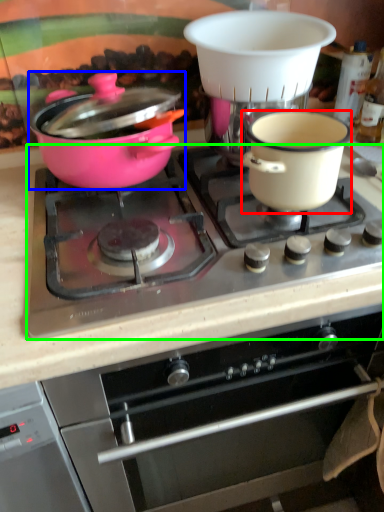
Question: Estimate the real-world distances between objects in this image. Which object is farther from bowl (highlighted by a red box), pot/pan (highlighted by a blue box) or gas stove (highlighted by a green box)?

Choices:
 (A) pot/pan
 (B) gas stove

Answer: (A)